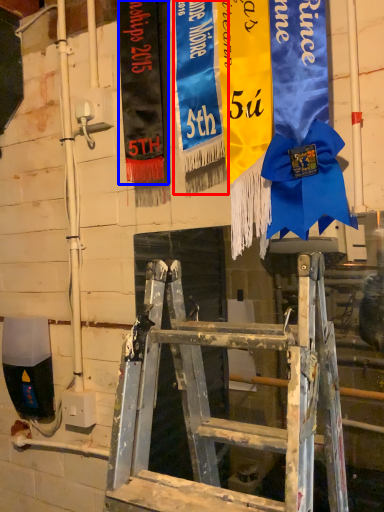
Question: Among these objects, which one is farthest to the camera, tapestry (highlighted by a red box) or tapestry (highlighted by a blue box)?

Choices:
 (A) tapestry
 (B) tapestry

Answer: (B)